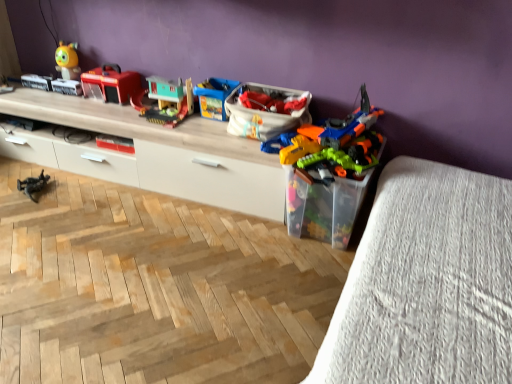
Question: Does wooden toy house at center, the 3th toy in the left-to-right sequence, come behind blue plastic toy at center, which is the fourth toy from left to right?

Choices:
 (A) yes
 (B) no

Answer: (B)

Question: Is wooden toy house at center, which is the 3th toy in right-to-left order, completely or partially outside of blue plastic toy at center, which is counted as the 2th toy, starting from the right?

Choices:
 (A) yes
 (B) no

Answer: (A)

Question: Considering the relative sizes of wooden toy house at center, which is the 3th toy in right-to-left order, and blue plastic toy at center, which is counted as the 2th toy, starting from the right, in the image provided, is wooden toy house at center, which is the 3th toy in right-to-left order, bigger than blue plastic toy at center, which is counted as the 2th toy, starting from the right,?

Choices:
 (A) no
 (B) yes

Answer: (B)

Question: Is wooden toy house at center, which is the 3th toy in right-to-left order, taller than blue plastic toy at center, which is counted as the 2th toy, starting from the right?

Choices:
 (A) yes
 (B) no

Answer: (A)

Question: Are wooden toy house at center, which is the 3th toy in right-to-left order, and blue plastic toy at center, which is the fourth toy from left to right, far apart?

Choices:
 (A) no
 (B) yes

Answer: (A)

Question: Looking at their shapes, would you say wooden toy house at center, the 3th toy in the left-to-right sequence, is wider or thinner than white fabric bag at center, positioned as the 1th storage box in top-to-bottom order?

Choices:
 (A) wide
 (B) thin

Answer: (B)

Question: Is wooden toy house at center, which is the 3th toy in right-to-left order, taller or shorter than white fabric bag at center, positioned as the 1th storage box in top-to-bottom order?

Choices:
 (A) tall
 (B) short

Answer: (B)

Question: Do you think wooden toy house at center, the 3th toy in the left-to-right sequence, is within white fabric bag at center, positioned as the 1th storage box in top-to-bottom order, or outside of it?

Choices:
 (A) outside
 (B) inside

Answer: (A)

Question: From a real-world perspective, relative to white fabric bag at center, the 2th storage box when ordered from bottom to top, is wooden toy house at center, which is the 3th toy in right-to-left order, vertically above or below?

Choices:
 (A) below
 (B) above

Answer: (A)

Question: Considering the positions of wooden at upper left and translucent plastic toy container at lower right in the image, is wooden at upper left wider or thinner than translucent plastic toy container at lower right?

Choices:
 (A) wide
 (B) thin

Answer: (B)

Question: From a real-world perspective, relative to translucent plastic toy container at lower right, is wooden at upper left vertically above or below?

Choices:
 (A) below
 (B) above

Answer: (A)

Question: From their relative heights in the image, would you say wooden at upper left is taller or shorter than translucent plastic toy container at lower right?

Choices:
 (A) short
 (B) tall

Answer: (A)

Question: In the image, is wooden at upper left on the left side or the right side of translucent plastic toy container at lower right?

Choices:
 (A) left
 (B) right

Answer: (A)

Question: Is metallic gray toy soldier at lower left, marked as the 1th toy in a left-to-right arrangement, wider or thinner than blue plastic toy at center, which is the fourth toy from left to right?

Choices:
 (A) wide
 (B) thin

Answer: (B)

Question: From a real-world perspective, is metallic gray toy soldier at lower left, marked as the 1th toy in a left-to-right arrangement, physically located above or below blue plastic toy at center, which is counted as the 2th toy, starting from the right?

Choices:
 (A) below
 (B) above

Answer: (A)